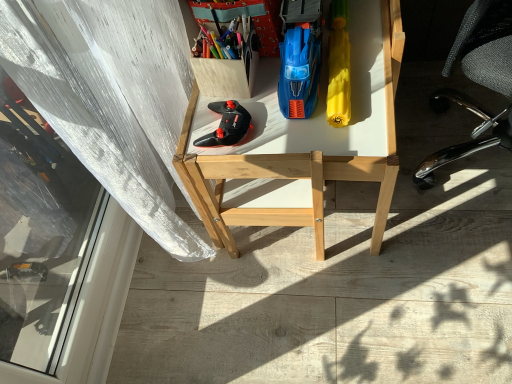
Question: Is wooden desk at center further to camera compared to black matte controller at center?

Choices:
 (A) yes
 (B) no

Answer: (B)

Question: Is wooden desk at center to the right of black matte controller at center from the viewer's perspective?

Choices:
 (A) yes
 (B) no

Answer: (A)

Question: From a real-world perspective, does wooden desk at center sit lower than black matte controller at center?

Choices:
 (A) no
 (B) yes

Answer: (B)

Question: From a real-world perspective, is wooden desk at center on black matte controller at center?

Choices:
 (A) yes
 (B) no

Answer: (B)

Question: Is wooden desk at center looking in the opposite direction of black matte controller at center?

Choices:
 (A) no
 (B) yes

Answer: (A)

Question: From a real-world perspective, is wooden box at upper left, which appears as the third stationery when viewed from the right, above or below wooden desk at center?

Choices:
 (A) below
 (B) above

Answer: (B)

Question: In terms of width, does wooden box at upper left, placed as the second stationery when sorted from left to right, look wider or thinner when compared to wooden desk at center?

Choices:
 (A) wide
 (B) thin

Answer: (B)

Question: From the image's perspective, relative to wooden desk at center, is wooden box at upper left, which appears as the third stationery when viewed from the right, above or below?

Choices:
 (A) below
 (B) above

Answer: (B)

Question: Is wooden box at upper left, placed as the second stationery when sorted from left to right, in front of or behind wooden desk at center in the image?

Choices:
 (A) behind
 (B) front

Answer: (A)

Question: From the image's perspective, is matte plastic container at upper center, positioned as the first stationery in left-to-right order, positioned above or below wooden box at upper left, placed as the second stationery when sorted from left to right?

Choices:
 (A) below
 (B) above

Answer: (B)

Question: Based on their sizes in the image, would you say matte plastic container at upper center, marked as the fourth stationery in a right-to-left arrangement, is bigger or smaller than wooden box at upper left, placed as the second stationery when sorted from left to right?

Choices:
 (A) small
 (B) big

Answer: (A)

Question: In the image, is matte plastic container at upper center, positioned as the first stationery in left-to-right order, on the left side or the right side of wooden box at upper left, which appears as the third stationery when viewed from the right?

Choices:
 (A) left
 (B) right

Answer: (A)

Question: Is matte plastic container at upper center, positioned as the first stationery in left-to-right order, spatially inside wooden box at upper left, which appears as the third stationery when viewed from the right, or outside of it?

Choices:
 (A) outside
 (B) inside

Answer: (A)

Question: From the image's perspective, is matte plastic container at upper center, marked as the fourth stationery in a right-to-left arrangement, above or below blue plastic toy car at center, the third stationery when ordered from left to right?

Choices:
 (A) below
 (B) above

Answer: (A)

Question: Considering the positions of matte plastic container at upper center, positioned as the first stationery in left-to-right order, and blue plastic toy car at center, the third stationery when ordered from left to right, in the image, is matte plastic container at upper center, positioned as the first stationery in left-to-right order, wider or thinner than blue plastic toy car at center, the third stationery when ordered from left to right,?

Choices:
 (A) thin
 (B) wide

Answer: (A)